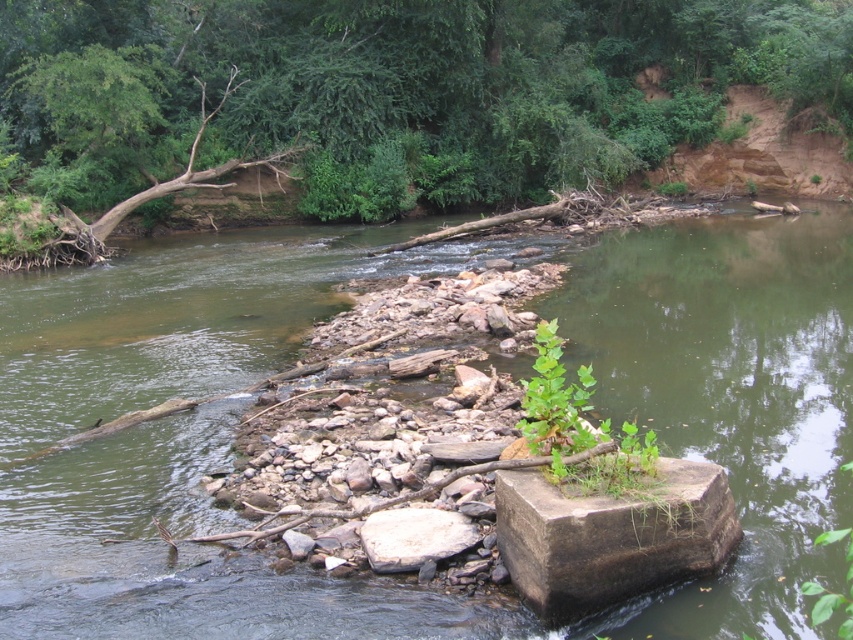
Identify the location of green stone at center. (341, 307).

From the picture: Between green stone at center and white smooth rock at center, which one has more height?

green stone at center

Is point (21, 449) farther from viewer compared to point (426, 522)?

Yes.

Where is `green stone at center`? The image size is (853, 640). green stone at center is located at coordinates (341, 307).

Can you confirm if brown wood log at upper center is thinner than white smooth rock at center?

No, brown wood log at upper center is not thinner than white smooth rock at center.

Is brown wood log at upper center taller than white smooth rock at center?

Yes.

What do you see at coordinates (398, 90) in the screenshot?
I see `brown wood log at upper center` at bounding box center [398, 90].

In order to click on brown wood log at upper center in this screenshot , I will do [398, 90].

Identify the location of brown concrete block at center. The height and width of the screenshot is (640, 853). (611, 536).

Who is shorter, brown concrete block at center or white smooth rock at center?

white smooth rock at center is shorter.

In the scene shown: Who is more forward, (573, 576) or (456, 534)?

Point (573, 576) is in front.

At what (x,y) coordinates should I click in order to perform the action: click on brown concrete block at center. Please return your answer as a coordinate pair (x, y). This screenshot has height=640, width=853. Looking at the image, I should click on (611, 536).